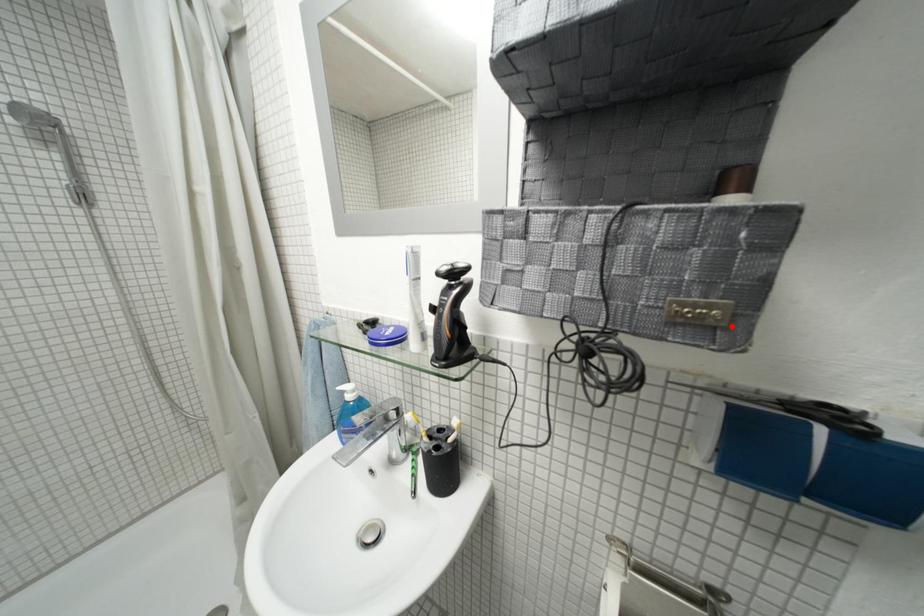
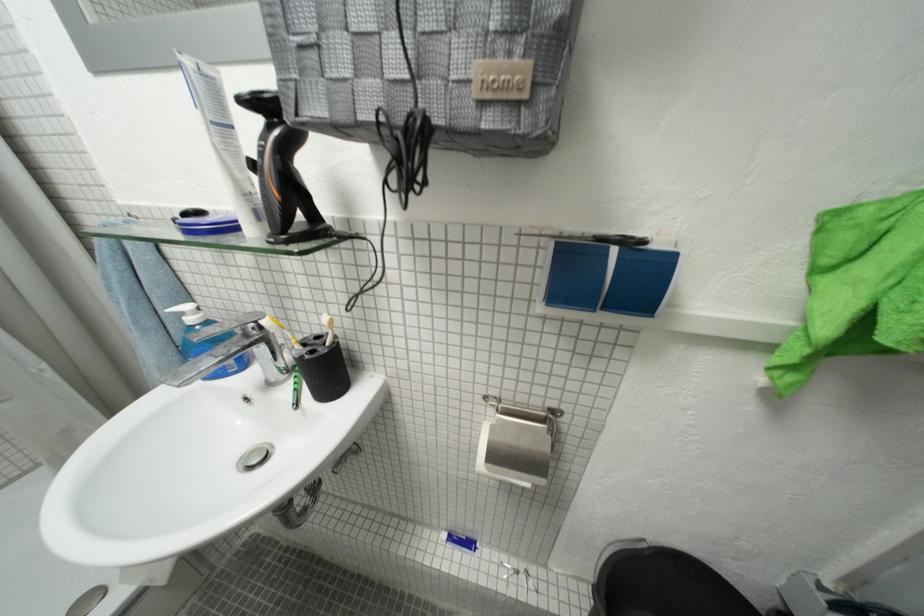
Find the pixel in the second image that matches the highlighted location in the first image.

(535, 98)